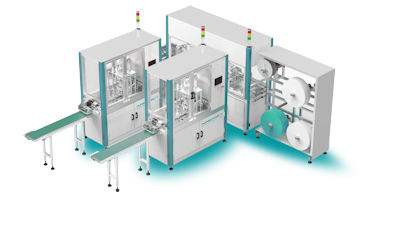
Find the location of a particular element. cupboards is located at coordinates (198, 139), (131, 119).